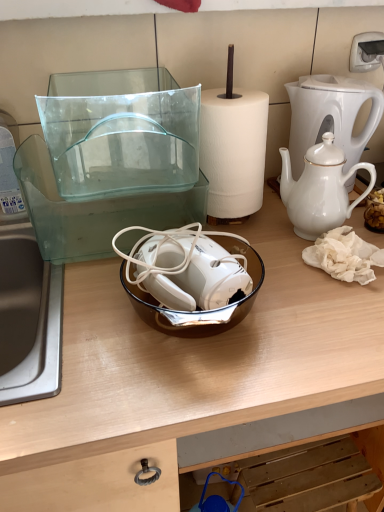
Find the location of a particular element. vacant area on top of transparent glass bowl at center (from a real-world perspective) is located at coordinates coord(222,328).